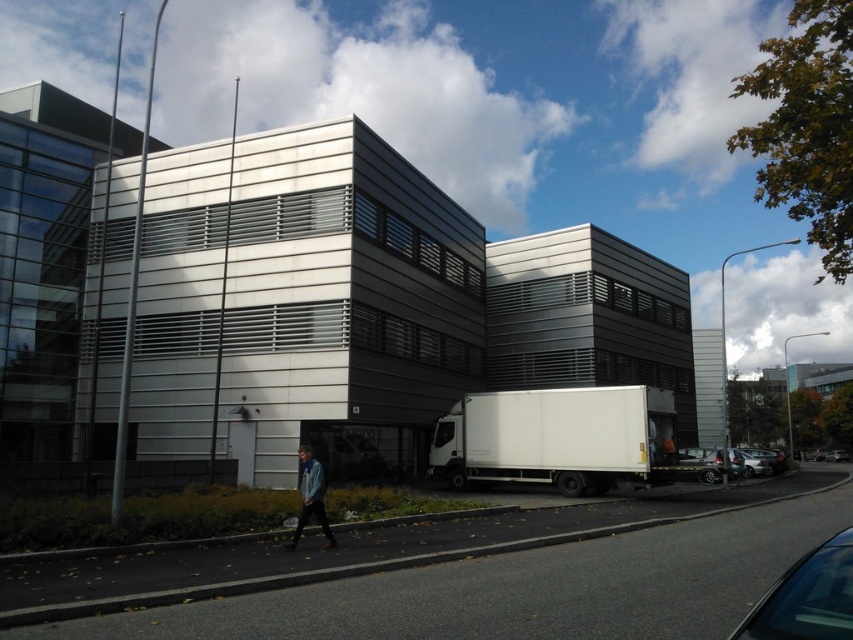
Question: Can you confirm if shiny black car at lower right is wider than metallic silver car at lower right?

Choices:
 (A) no
 (B) yes

Answer: (A)

Question: Which point appears farthest from the camera in this image?

Choices:
 (A) (749, 461)
 (B) (837, 634)
 (C) (775, 458)

Answer: (C)

Question: Is white matte trailer truck at center below metallic silver car at lower right?

Choices:
 (A) no
 (B) yes

Answer: (A)

Question: Can you confirm if denim jacket at lower center is wider than metallic silver car at lower right?

Choices:
 (A) yes
 (B) no

Answer: (B)

Question: Which point is farther from the camera taking this photo?

Choices:
 (A) (819, 628)
 (B) (756, 464)
 (C) (619, 452)

Answer: (B)

Question: Which point is closer to the camera?

Choices:
 (A) metallic silver car at lower right
 (B) denim jacket at lower center
 (C) metallic silver sedan at lower right
 (D) shiny black car at lower right

Answer: (D)